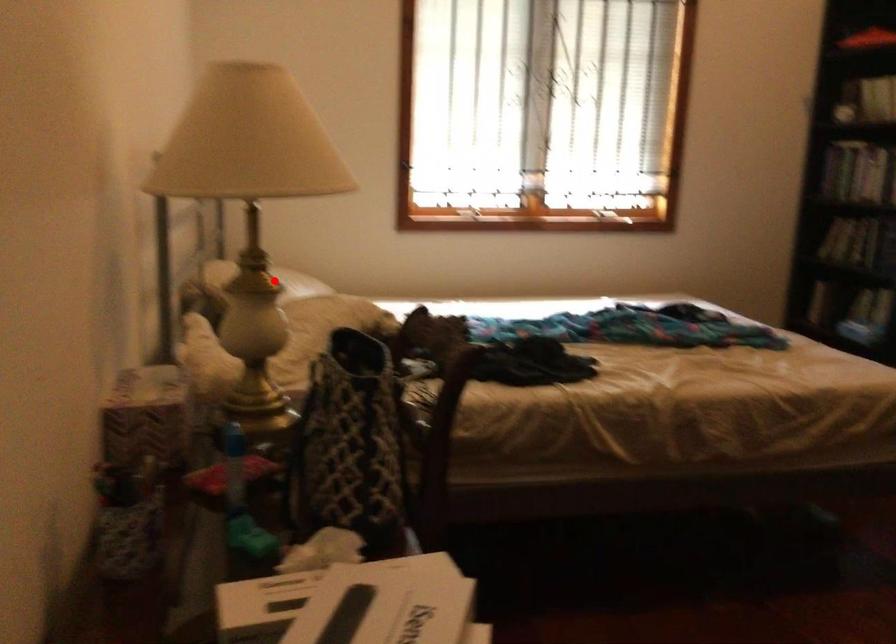
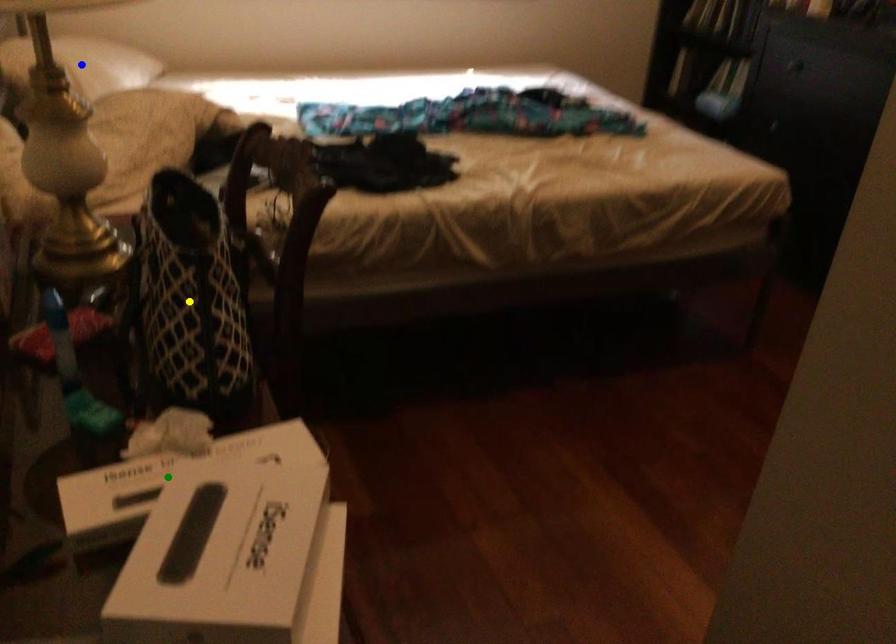
Question: I am providing you with two images of the same scene from different viewpoints. A red point is marked on the first image. You are given multiple points on the second image. Which mark in image 2 goes with the point in image 1?

Choices:
 (A) green point
 (B) yellow point
 (C) blue point

Answer: (C)